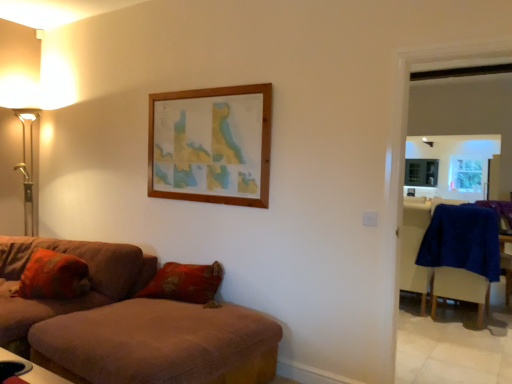
Question: Considering the relative sizes of blue fabric armchair at right and gold metallic floor lamp at left in the image provided, is blue fabric armchair at right wider than gold metallic floor lamp at left?

Choices:
 (A) yes
 (B) no

Answer: (B)

Question: Could you tell me if blue fabric armchair at right is facing gold metallic floor lamp at left?

Choices:
 (A) no
 (B) yes

Answer: (A)

Question: From a real-world perspective, is blue fabric armchair at right positioned over gold metallic floor lamp at left based on gravity?

Choices:
 (A) yes
 (B) no

Answer: (B)

Question: Considering the relative positions of blue fabric armchair at right and gold metallic floor lamp at left in the image provided, is blue fabric armchair at right behind gold metallic floor lamp at left?

Choices:
 (A) yes
 (B) no

Answer: (A)

Question: Can you confirm if blue fabric armchair at right is bigger than gold metallic floor lamp at left?

Choices:
 (A) yes
 (B) no

Answer: (B)

Question: Is gold metallic floor lamp at left to the left or to the right of brown fabric ottoman at lower left, the 2th studio couch when ordered from left to right, in the image?

Choices:
 (A) right
 (B) left

Answer: (B)

Question: From the image's perspective, is gold metallic floor lamp at left located above or below brown fabric ottoman at lower left, placed as the first studio couch when sorted from right to left?

Choices:
 (A) above
 (B) below

Answer: (A)

Question: Considering their positions, is gold metallic floor lamp at left located in front of or behind brown fabric ottoman at lower left, the 2th studio couch when ordered from left to right?

Choices:
 (A) behind
 (B) front

Answer: (A)

Question: Considering the positions of point (22, 104) and point (274, 352), is point (22, 104) closer or farther from the camera than point (274, 352)?

Choices:
 (A) closer
 (B) farther

Answer: (B)

Question: Which is correct: gold metallic floor lamp at left is inside brown fabric couch at lower left, which is the 1th studio couch in left-to-right order, or outside of it?

Choices:
 (A) inside
 (B) outside

Answer: (B)

Question: Is point (16, 87) closer or farther from the camera than point (113, 296)?

Choices:
 (A) closer
 (B) farther

Answer: (B)

Question: From a real-world perspective, is gold metallic floor lamp at left physically located above or below brown fabric couch at lower left, which is the 1th studio couch in left-to-right order?

Choices:
 (A) below
 (B) above

Answer: (B)

Question: From the image's perspective, is gold metallic floor lamp at left above or below brown fabric couch at lower left, which is the 1th studio couch in left-to-right order?

Choices:
 (A) below
 (B) above

Answer: (B)

Question: From the image's perspective, is textured orange pillow at lower left above or below brown fabric ottoman at lower left, placed as the first studio couch when sorted from right to left?

Choices:
 (A) above
 (B) below

Answer: (A)

Question: Is textured orange pillow at lower left inside the boundaries of brown fabric ottoman at lower left, the 2th studio couch when ordered from left to right, or outside?

Choices:
 (A) inside
 (B) outside

Answer: (B)